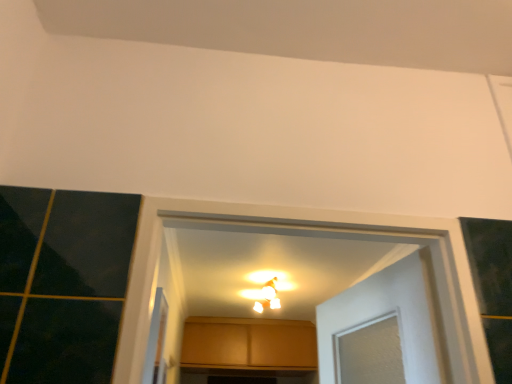
Question: Is matte wood cabinet at center taller or shorter than clear plastic screen door at lower left?

Choices:
 (A) short
 (B) tall

Answer: (B)

Question: Is point (230, 360) closer or farther from the camera than point (161, 332)?

Choices:
 (A) closer
 (B) farther

Answer: (B)

Question: Based on their relative distances, which object is farther from the matte white light fixture at center?

Choices:
 (A) clear plastic screen door at lower left
 (B) matte wood cabinet at center

Answer: (A)

Question: Based on their relative distances, which object is nearer to the matte wood cabinet at center?

Choices:
 (A) clear plastic screen door at lower left
 (B) matte white light fixture at center

Answer: (B)